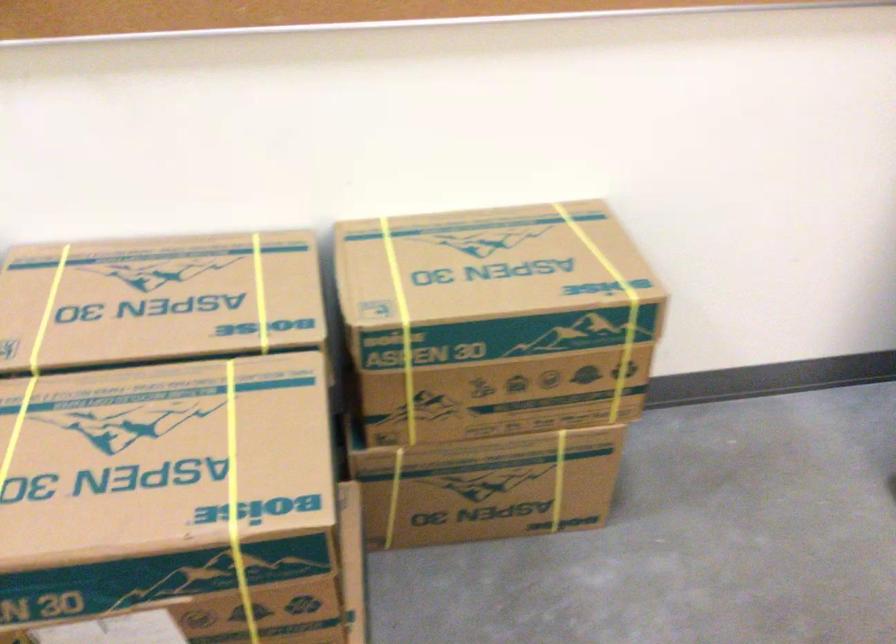
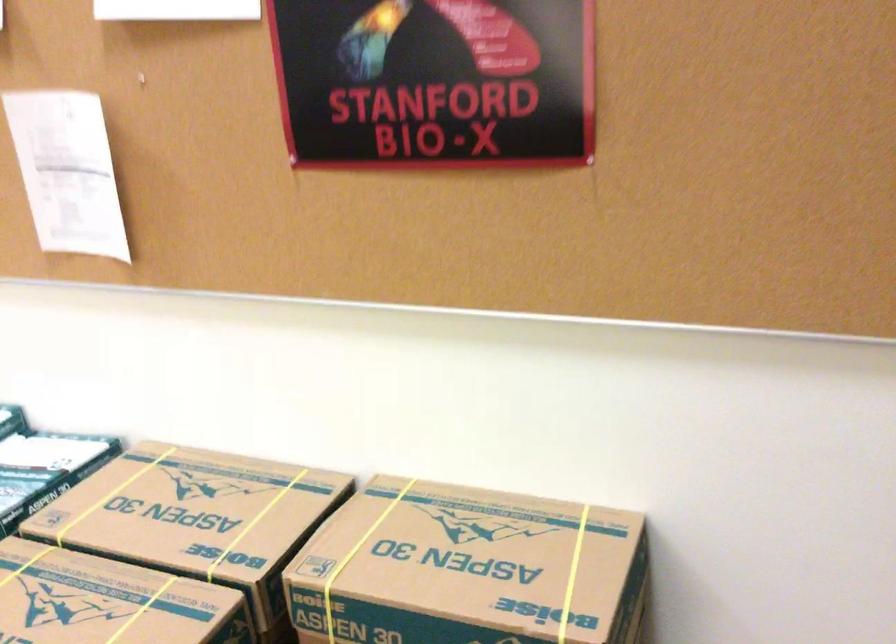
Locate, in the second image, the point that corresponds to point 264,292 in the first image.

(254, 523)